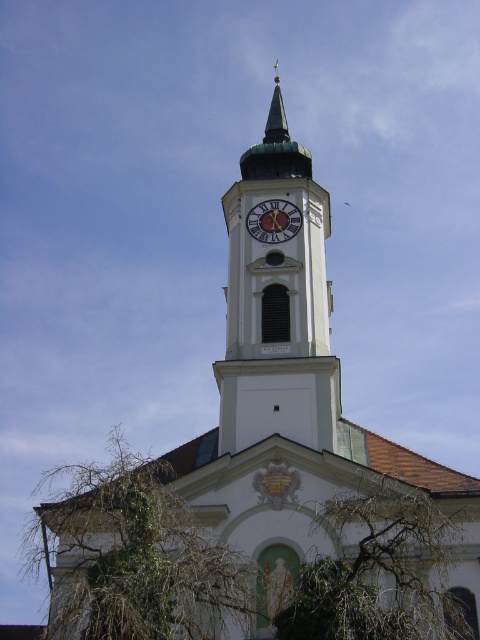
Question: Does white stone clock tower at center have a lesser width compared to gold metallic clock at center?

Choices:
 (A) yes
 (B) no

Answer: (B)

Question: Among these points, which one is farthest from the camera?

Choices:
 (A) (359, 524)
 (B) (154, 548)
 (C) (305, 385)

Answer: (C)

Question: Does green leafy tree at lower left appear under gold metallic clock at center?

Choices:
 (A) yes
 (B) no

Answer: (A)

Question: Which of the following is the farthest from the observer?

Choices:
 (A) (265, 237)
 (B) (434, 556)
 (C) (111, 513)
 (D) (252, 161)

Answer: (D)

Question: Estimate the real-world distances between objects in this image. Which object is closer to the gold metallic clock at center?

Choices:
 (A) green leafy tree at center
 (B) green leafy tree at lower left
 (C) white stone clock tower at center

Answer: (C)

Question: Does white stone clock tower at center appear on the right side of gold metallic clock at center?

Choices:
 (A) no
 (B) yes

Answer: (B)